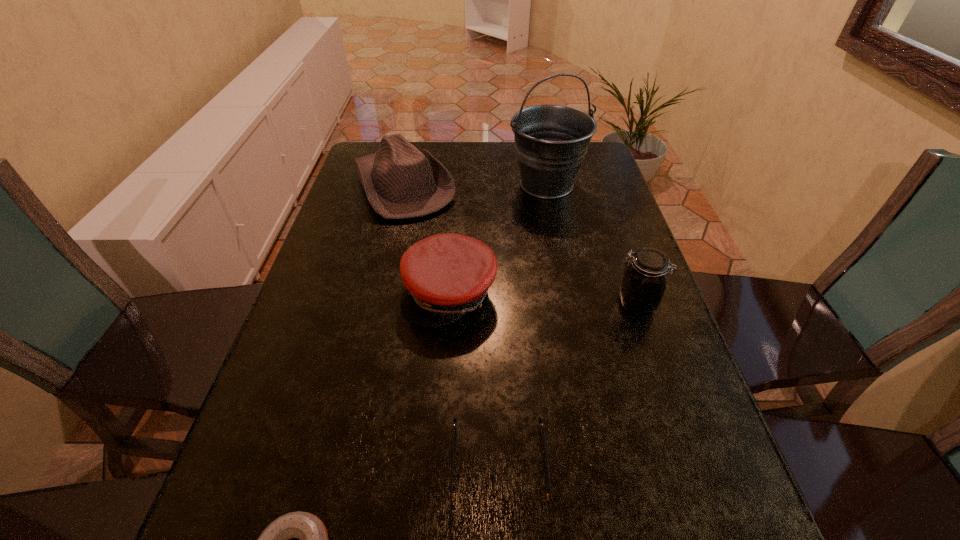
The width and height of the screenshot is (960, 540). In order to click on bucket in this screenshot , I will do `click(551, 141)`.

Identify the location of fedora. The image size is (960, 540). (400, 181).

Find the location of `jar`. jar is located at coordinates (643, 284).

Find the location of a particular element. This screenshot has height=540, width=960. the fourth tallest object is located at coordinates (446, 276).

In order to click on the fifth farthest object in this screenshot , I will do `click(462, 502)`.

This screenshot has width=960, height=540. What are the coordinates of `spectacles` in the screenshot? It's located at (462, 502).

Identify the location of blank area located 0.210m on the front of the bucket. click(x=561, y=254).

The height and width of the screenshot is (540, 960). In order to click on free location located on the front of the fedora in this screenshot , I will do `click(372, 322)`.

This screenshot has width=960, height=540. I want to click on vacant point located on the lid of the jar, so point(454,303).

Identify the location of free space located 0.150m on the lid of the jar. (550, 303).